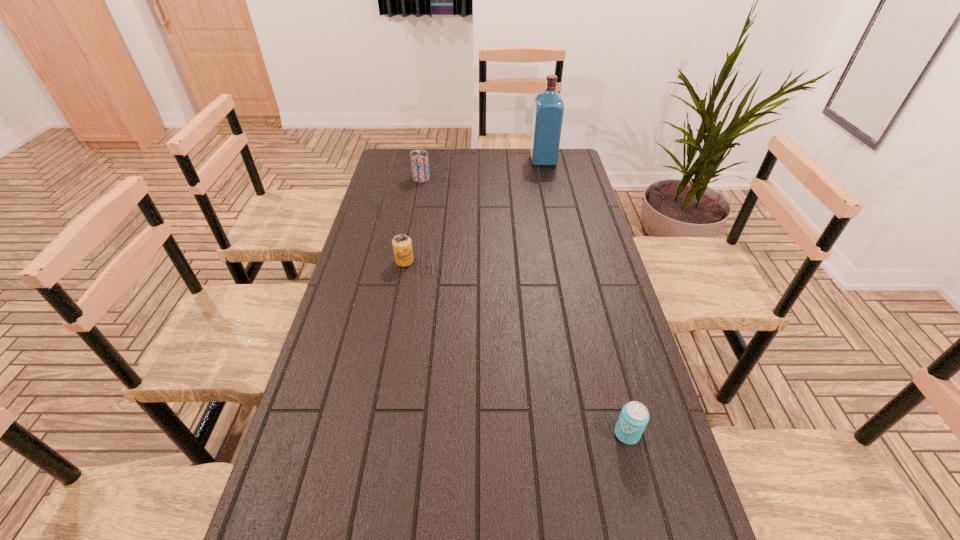
This screenshot has height=540, width=960. I want to click on the farthest object, so click(548, 112).

The height and width of the screenshot is (540, 960). In order to click on liquor in this screenshot , I will do `click(548, 112)`.

Identify the location of the farthest beer can. (419, 158).

The image size is (960, 540). I want to click on the second farthest beer can, so click(402, 247).

I want to click on the nearest beer can, so click(x=634, y=416).

Find the location of a particular element. The height and width of the screenshot is (540, 960). the rightmost beer can is located at coordinates (634, 416).

Identify the location of blank space located 0.250m on the flat label side of the liquor. Image resolution: width=960 pixels, height=540 pixels. (475, 160).

I want to click on free spot located 0.390m on the flat label side of the liquor, so click(x=444, y=160).

In order to click on blank space located 0.100m on the flat label side of the liquor in this screenshot , I will do `click(509, 160)`.

The height and width of the screenshot is (540, 960). I want to click on vacant space located on the front of the farthest beer can, so click(420, 191).